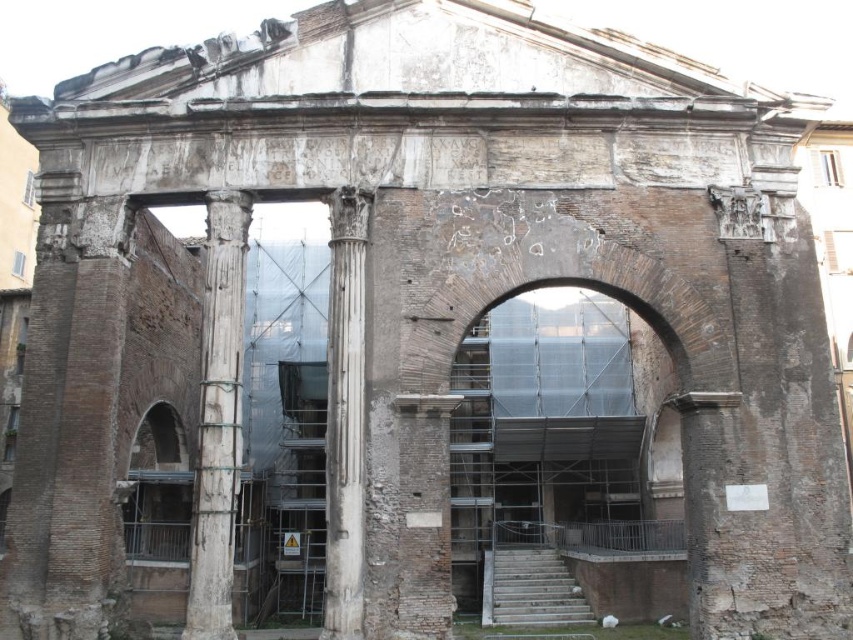
Question: Is white marble column at left above white marble column at center?

Choices:
 (A) yes
 (B) no

Answer: (A)

Question: From the image, what is the correct spatial relationship of white marble column at left in relation to white marble column at center?

Choices:
 (A) above
 (B) below

Answer: (A)

Question: Which of the following is the farthest from the observer?

Choices:
 (A) (349, 216)
 (B) (229, 260)

Answer: (A)

Question: Which point is farther to the camera?

Choices:
 (A) (339, 284)
 (B) (207, 480)

Answer: (A)

Question: Can you confirm if white marble column at left is positioned to the right of white marble column at center?

Choices:
 (A) yes
 (B) no

Answer: (B)